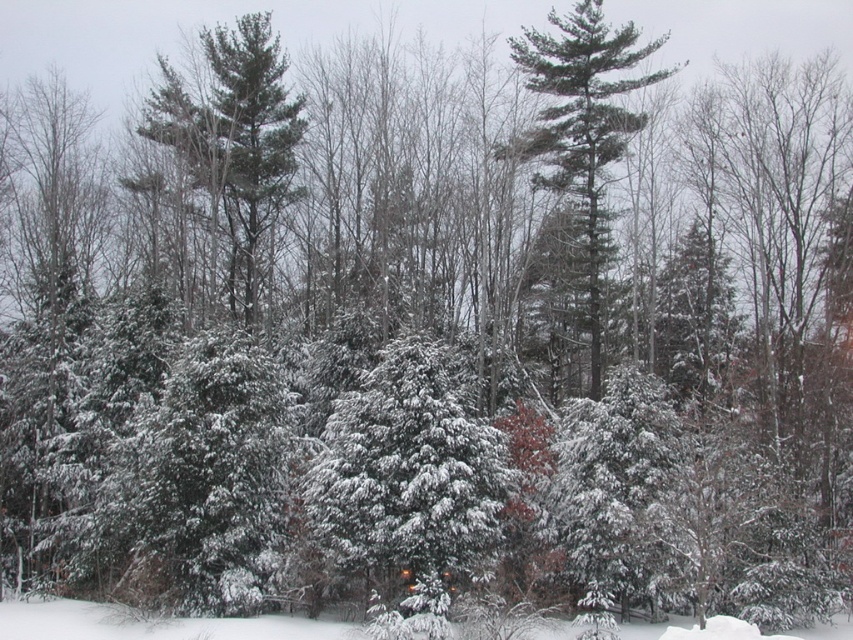
You are an animal trying to find shelter during a snowstorm. You see a green matte tree at center and white fluffy snow at lower center. Which location would provide better protection from the snowfall?

The green matte tree at center has a larger size compared to white fluffy snow at lower center, so it would provide better protection from the snowfall.